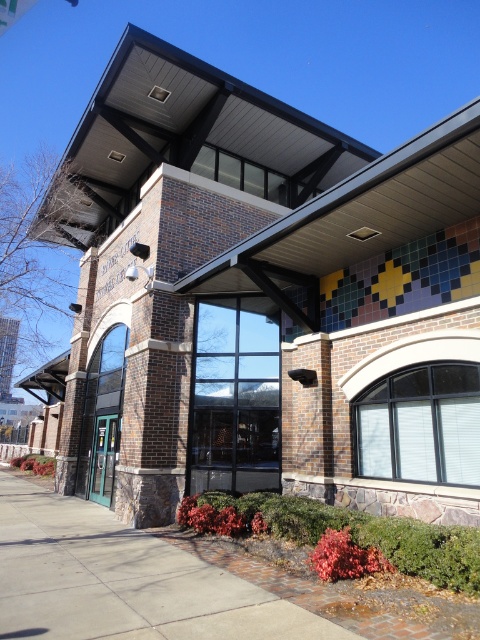
Question: Does gray concrete sidewalk at lower left have a greater width compared to matte glass door at center?

Choices:
 (A) no
 (B) yes

Answer: (B)

Question: Which point is closer to the camera?

Choices:
 (A) matte glass door at center
 (B) gray concrete sidewalk at lower left

Answer: (B)

Question: Is gray concrete sidewalk at lower left positioned behind matte glass door at center?

Choices:
 (A) no
 (B) yes

Answer: (A)

Question: Is gray concrete sidewalk at lower left wider than matte glass door at center?

Choices:
 (A) yes
 (B) no

Answer: (A)

Question: Which point is closer to the camera?

Choices:
 (A) (68, 515)
 (B) (108, 499)

Answer: (A)